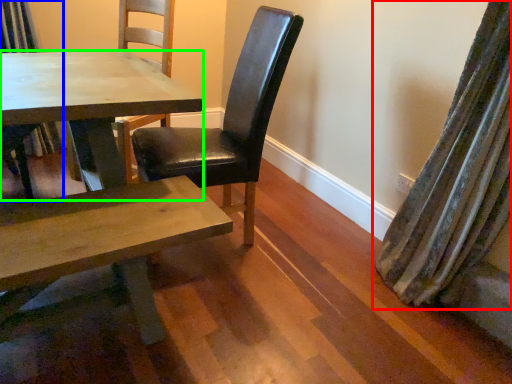
Question: Considering the real-world distances, which object is farthest from curtain (highlighted by a red box)? chair (highlighted by a blue box) or kitchen & dining room table (highlighted by a green box)?

Choices:
 (A) chair
 (B) kitchen & dining room table

Answer: (A)